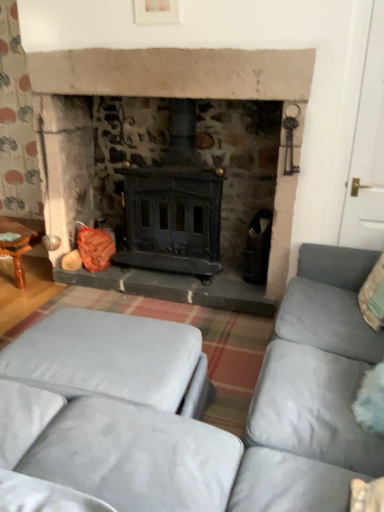
Question: Should I look upward or downward to see velvet grey ottoman at lower left?

Choices:
 (A) up
 (B) down

Answer: (B)

Question: Can you confirm if wooden table at left is positioned to the right of velvet grey ottoman at lower left?

Choices:
 (A) no
 (B) yes

Answer: (A)

Question: Is wooden table at left next to velvet grey ottoman at lower left?

Choices:
 (A) yes
 (B) no

Answer: (B)

Question: From a real-world perspective, does wooden table at left stand above velvet grey ottoman at lower left?

Choices:
 (A) no
 (B) yes

Answer: (A)

Question: Does wooden table at left have a greater height compared to velvet grey ottoman at lower left?

Choices:
 (A) no
 (B) yes

Answer: (A)

Question: Can you confirm if wooden table at left is thinner than velvet grey ottoman at lower left?

Choices:
 (A) yes
 (B) no

Answer: (A)

Question: Is wooden table at left closer to camera compared to velvet grey ottoman at lower left?

Choices:
 (A) no
 (B) yes

Answer: (A)

Question: Does wooden table at left have a greater height compared to velvet grey couch at center?

Choices:
 (A) no
 (B) yes

Answer: (A)

Question: Is the surface of wooden table at left in direct contact with velvet grey couch at center?

Choices:
 (A) no
 (B) yes

Answer: (A)

Question: Is wooden table at left shorter than velvet grey couch at center?

Choices:
 (A) no
 (B) yes

Answer: (B)

Question: Could you tell me if wooden table at left is turned towards velvet grey couch at center?

Choices:
 (A) yes
 (B) no

Answer: (B)

Question: From the image's perspective, is wooden table at left located above velvet grey couch at center?

Choices:
 (A) no
 (B) yes

Answer: (B)

Question: From a real-world perspective, is wooden table at left under velvet grey couch at center?

Choices:
 (A) yes
 (B) no

Answer: (A)

Question: Is velvet grey ottoman at lower left thinner than velvet grey couch at center?

Choices:
 (A) no
 (B) yes

Answer: (B)